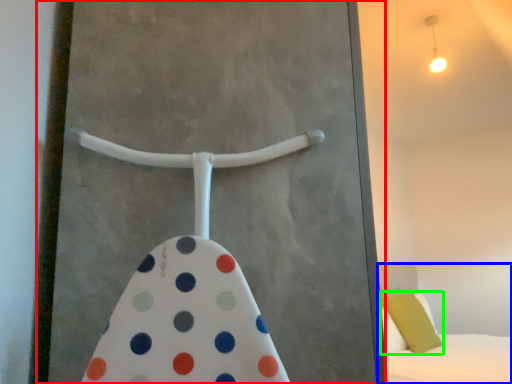
Question: Estimate the real-world distances between objects in this image. Which object is closer to screen door (highlighted by a red box), bed (highlighted by a blue box) or pillow (highlighted by a green box)?

Choices:
 (A) bed
 (B) pillow

Answer: (A)